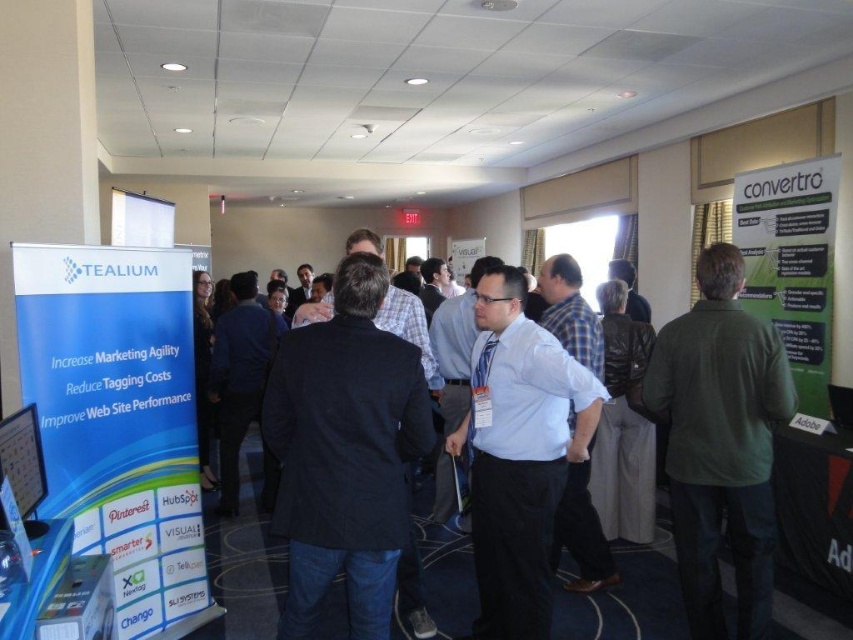
Question: Is green cotton shirt at right to the left of white shirt at center from the viewer's perspective?

Choices:
 (A) yes
 (B) no

Answer: (B)

Question: Can you confirm if green cotton shirt at right is bigger than white shirt at center?

Choices:
 (A) yes
 (B) no

Answer: (B)

Question: Which point is closer to the camera?

Choices:
 (A) (456, 561)
 (B) (744, 369)

Answer: (B)

Question: Is green cotton shirt at right smaller than white shirt at center?

Choices:
 (A) no
 (B) yes

Answer: (B)